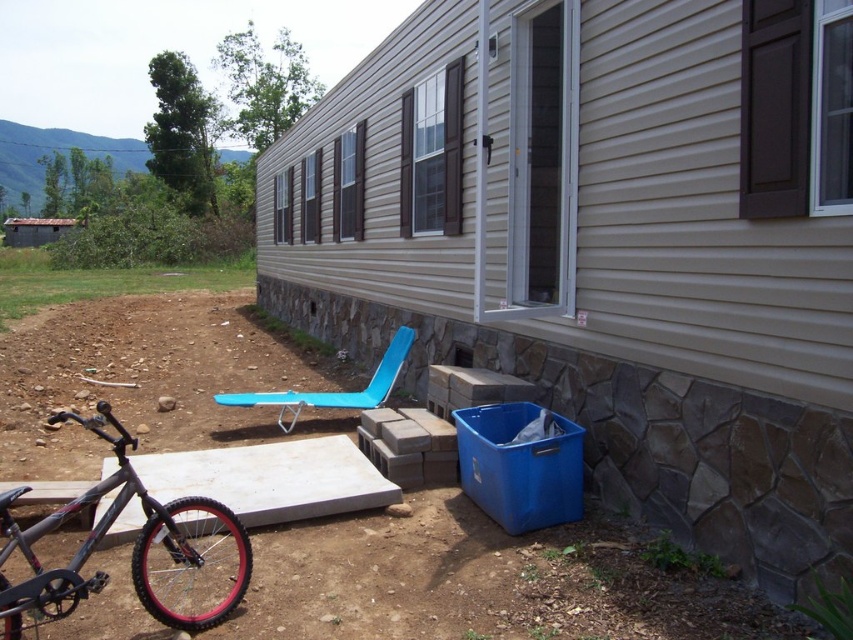
You are a contractor inspecting the construction site. You notice the shiny black frame at lower left and the blue plastic beach chair at lower center. Which object is located closer to the ground?

The shiny black frame at lower left is positioned under the blue plastic beach chair at lower center, so it is closer to the ground.

You are a contractor assessing the site. You need to place a 1.5m tall temporary structure between the shiny black frame at lower left and the blue plastic beach chair at lower center. Can you determine which object you should position the structure next to so it doesn

The shiny black frame at lower left has a lesser height compared to blue plastic beach chair at lower center. Therefore, the temporary structure should be placed next to the shiny black frame at lower left to avoid blocking the view of the taller blue plastic beach chair at lower center.

You are standing at the point where the blue plastic lounge chair is placed against the mobile home. From your current position, which direction should you move to reach the shiny black frame at lower left located at point [132,548]?

The shiny black frame at lower left is located at point [132,548]. Since you are at the blue plastic lounge chair position, you should move towards the lower left direction to reach the shiny black frame at lower left.